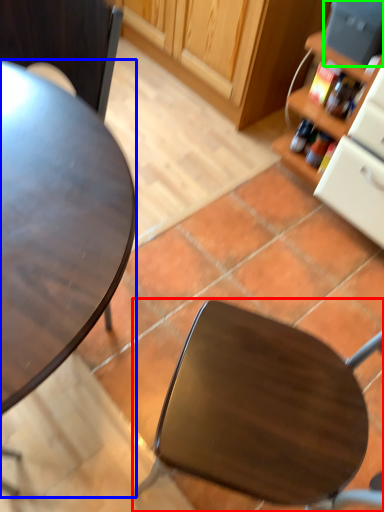
Question: Considering the real-world distances, which object is closest to chair (highlighted by a red box)? desk (highlighted by a blue box) or appliance (highlighted by a green box).

Choices:
 (A) desk
 (B) appliance

Answer: (A)